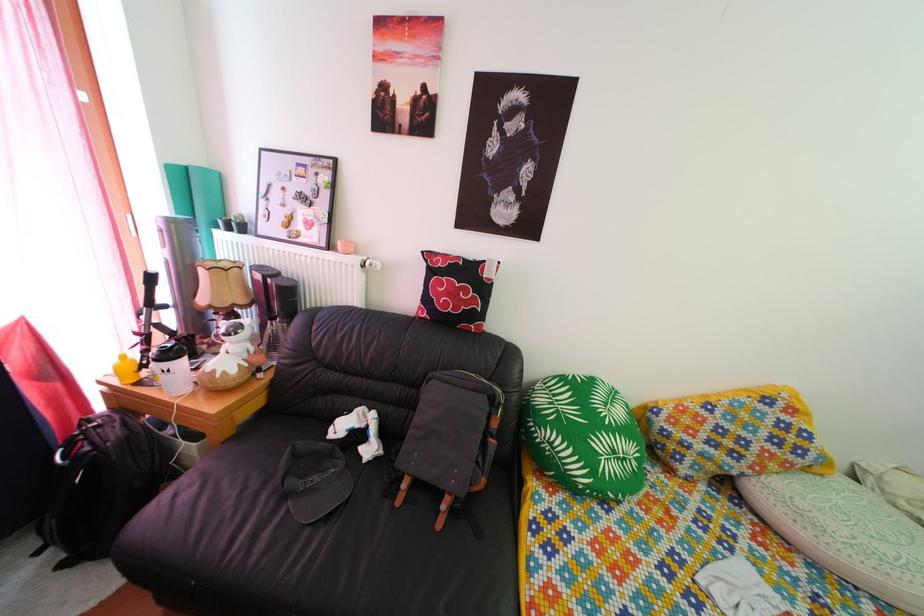
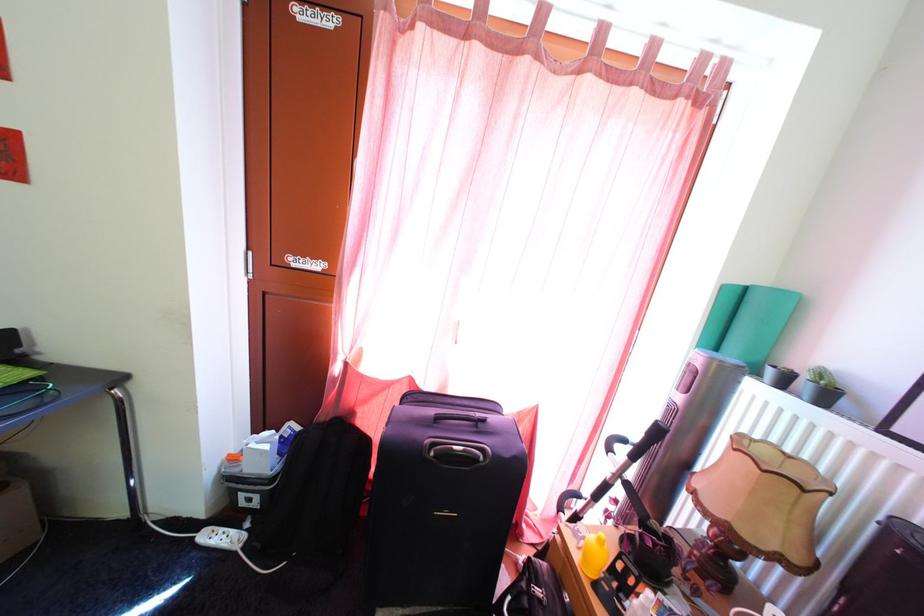
Where in the second image is the point corresponding to (126,391) from the first image?

(585, 565)